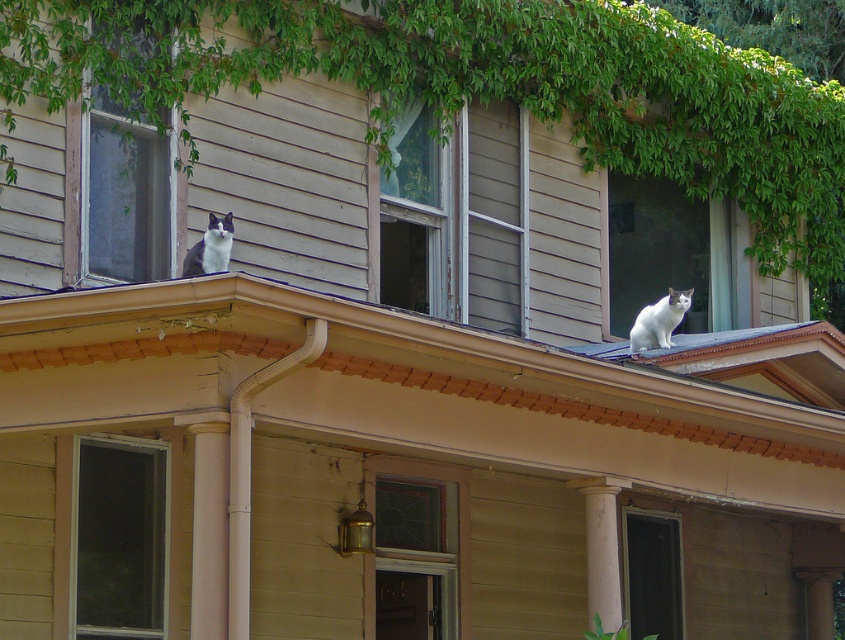
This screenshot has height=640, width=845. What do you see at coordinates (601, 548) in the screenshot?
I see `white marble column at center` at bounding box center [601, 548].

Who is lower down, white marble column at center or white fur cat at upper right?

white marble column at center is lower down.

Which is behind, point (619, 488) or point (631, 336)?

The point (631, 336) is behind.

Identify the location of white marble column at center. (601, 548).

Between wooden window at center and black-and-white fur cat at upper left, which one is positioned lower?

black-and-white fur cat at upper left is lower down.

Does wooden window at center appear on the left side of black-and-white fur cat at upper left?

Incorrect, wooden window at center is not on the left side of black-and-white fur cat at upper left.

Is point (404, 204) positioned behind point (204, 232)?

Yes, it is.

Where is `wooden window at center`? The width and height of the screenshot is (845, 640). wooden window at center is located at coordinates (458, 218).

Between point (658, 589) and point (631, 337), which one is positioned behind?

Positioned behind is point (658, 589).

Find the location of `transparent glass door at lower right`. transparent glass door at lower right is located at coordinates (653, 573).

The image size is (845, 640). I want to click on transparent glass door at lower right, so tap(653, 573).